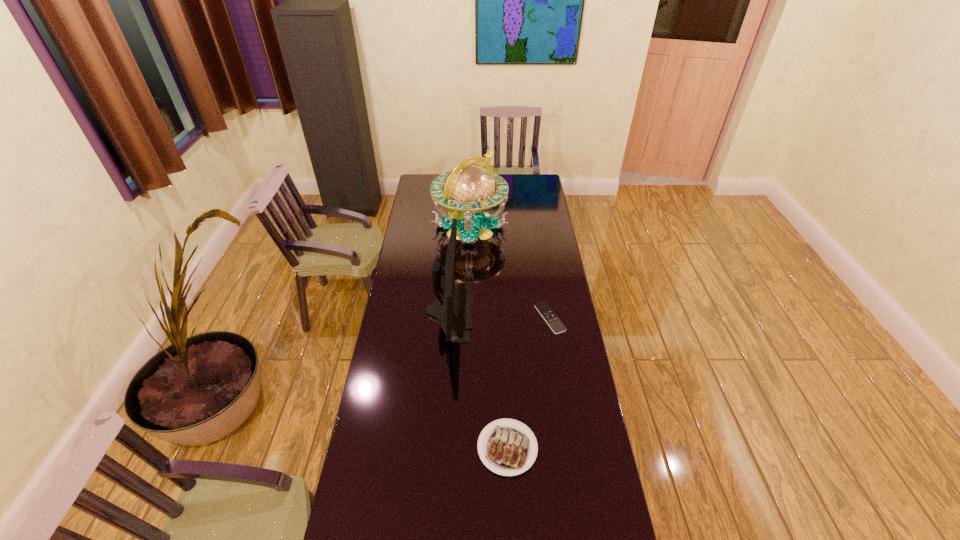
Identify the location of free location located 0.370m on the back of the shortest object. The image size is (960, 540). (540, 251).

Where is `object located at the left edge`? The height and width of the screenshot is (540, 960). object located at the left edge is located at coordinates (469, 188).

Identify the location of object located at the right edge. (544, 309).

Where is `free space at the left edge of the desktop`? This screenshot has height=540, width=960. free space at the left edge of the desktop is located at coordinates (435, 208).

In the image, there is a desktop. Where is `vacant space at the right edge`? The image size is (960, 540). vacant space at the right edge is located at coordinates (545, 217).

The width and height of the screenshot is (960, 540). I want to click on free space between the monitor and the third tallest object, so click(x=479, y=380).

Where is `vacant space that is in between the globe and the remote control`? vacant space that is in between the globe and the remote control is located at coordinates (510, 272).

Locate an element on the screen. Image resolution: width=960 pixels, height=540 pixels. vacant area that lies between the third tallest object and the tallest object is located at coordinates (489, 337).

Locate an element on the screen. Image resolution: width=960 pixels, height=540 pixels. free space between the shortest object and the monitor is located at coordinates (500, 315).

This screenshot has height=540, width=960. Identify the location of free area in between the third shortest object and the remote control. [x=500, y=315].